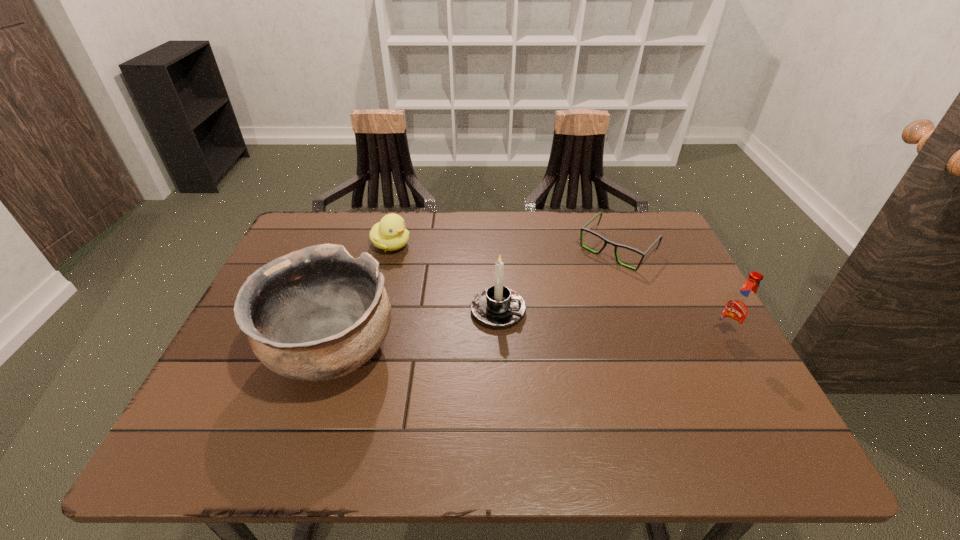
Locate an element on the screen. The height and width of the screenshot is (540, 960). pottery is located at coordinates pos(316,314).

Locate an element on the screen. The width and height of the screenshot is (960, 540). the rightmost object is located at coordinates (738, 310).

This screenshot has width=960, height=540. Find the location of `candle holder`. candle holder is located at coordinates (498, 306).

I want to click on the second object from right to left, so click(x=583, y=228).

Find the location of `spectacles`. spectacles is located at coordinates (583, 228).

Locate an element on the screen. Image resolution: width=960 pixels, height=540 pixels. the second shortest object is located at coordinates (390, 234).

Identify the location of blank space located 0.090m on the left of the pottery. (228, 352).

Locate an element on the screen. This screenshot has height=540, width=960. vacant space situated 0.090m on the front of the root beer is located at coordinates (747, 377).

The height and width of the screenshot is (540, 960). What are the coordinates of `vacant position located 0.180m with a handle on the side of the candle holder` in the screenshot? It's located at (595, 346).

Find the location of a particular element. free space located 0.300m with a handle on the side of the candle holder is located at coordinates (649, 365).